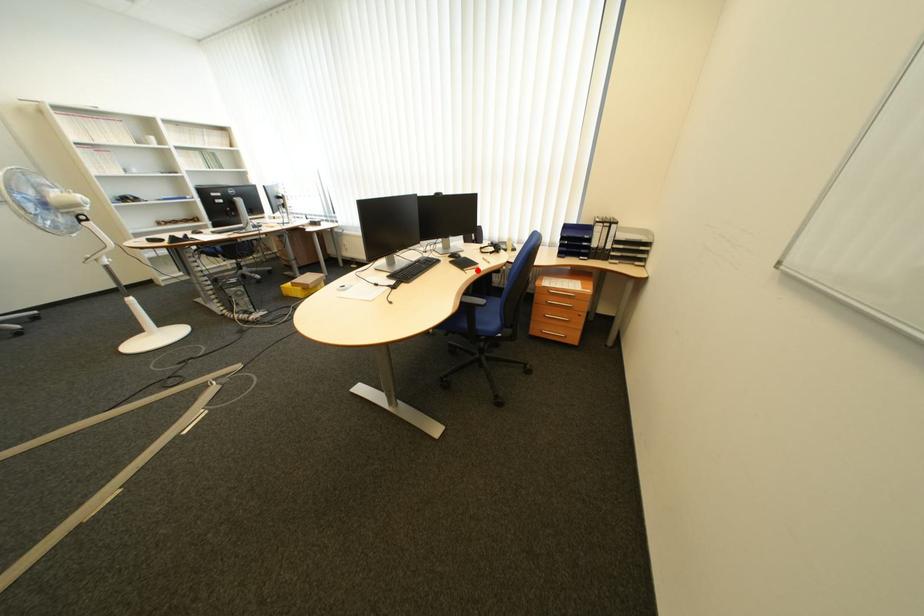
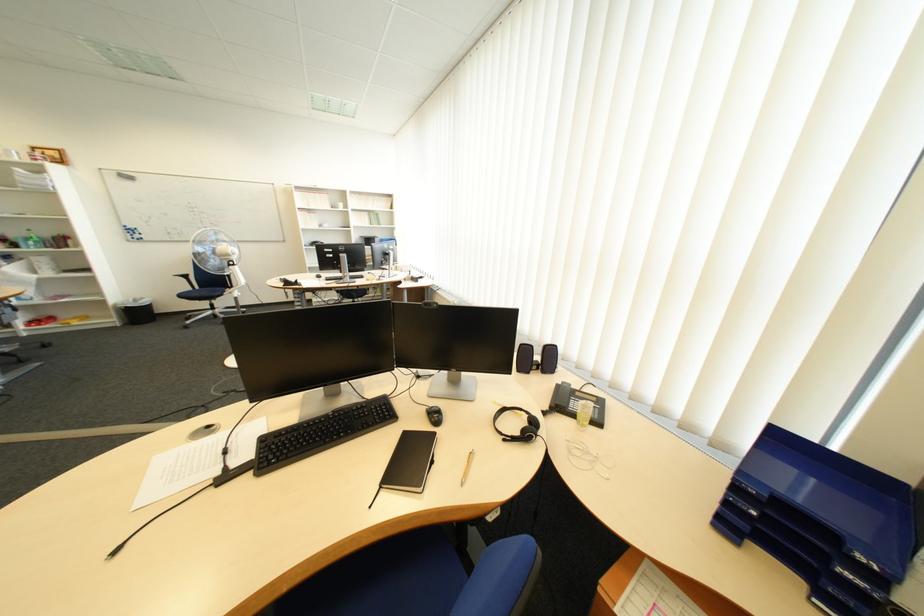
In the second image, find the point that corresponds to the highlighted location in the first image.

(396, 488)